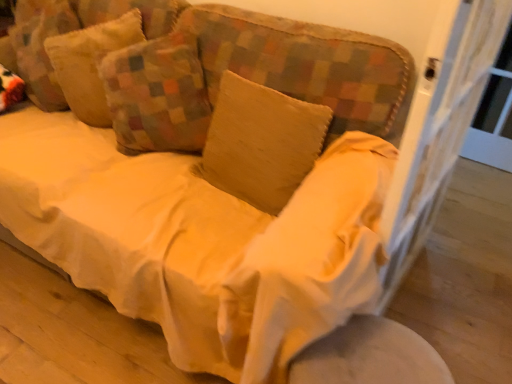
Where is `vacant area on top of white fabric round table at lower right (from a real-world perspective)`? The height and width of the screenshot is (384, 512). vacant area on top of white fabric round table at lower right (from a real-world perspective) is located at coordinates (356, 357).